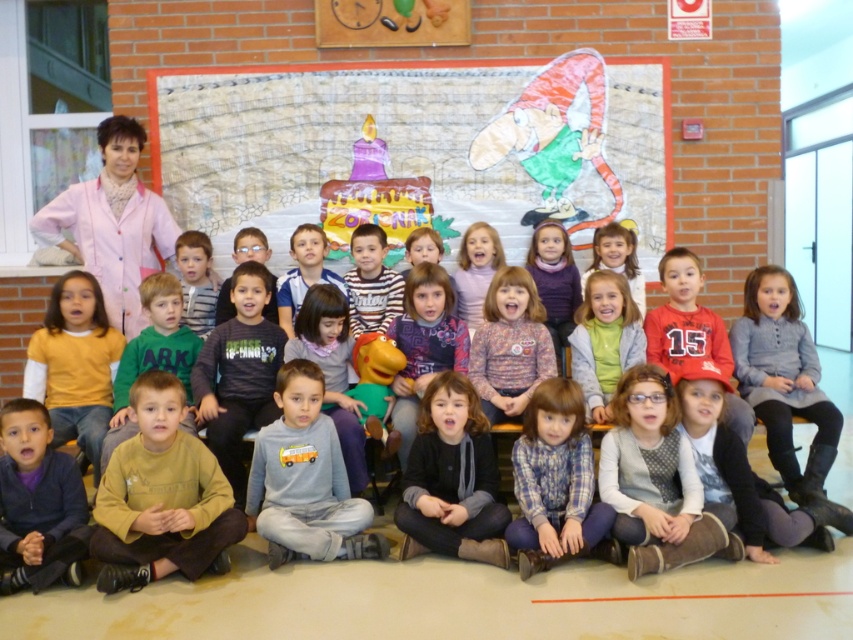
Question: Which point is farther to the camera?

Choices:
 (A) (422, 513)
 (B) (245, 124)
 (C) (122, 499)
 (D) (22, 545)

Answer: (B)

Question: Observing the image, what is the correct spatial positioning of plaid fabric shirt at center in reference to fluffy pink sweater at center?

Choices:
 (A) above
 (B) below

Answer: (B)

Question: Which object appears closest to the camera in this image?

Choices:
 (A) white textured sweater at center
 (B) dark brown hair at center
 (C) brown cotton shirt at center
 (D) light brown hair at center

Answer: (C)

Question: Does dark brown hair at center have a larger size compared to fluffy pink sweater at center?

Choices:
 (A) no
 (B) yes

Answer: (B)

Question: Estimate the real-world distances between objects in this image. Which object is closer to the white textured sweater at center?

Choices:
 (A) gray cotton shirt at center
 (B) dark blue fleece jacket at lower left
 (C) fluffy pink sweater at center

Answer: (C)

Question: Is plaid fabric shirt at center wider than light brown hair at center?

Choices:
 (A) yes
 (B) no

Answer: (A)